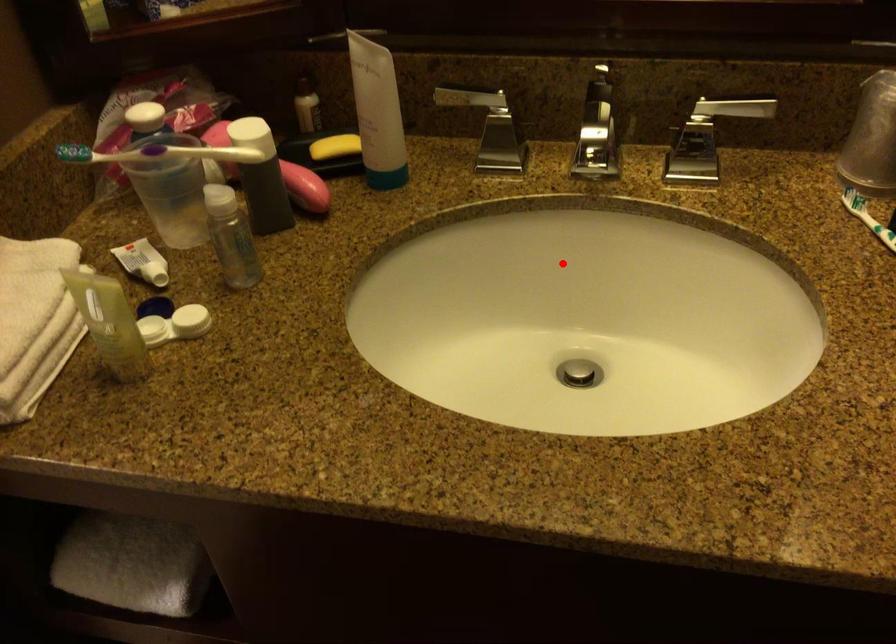
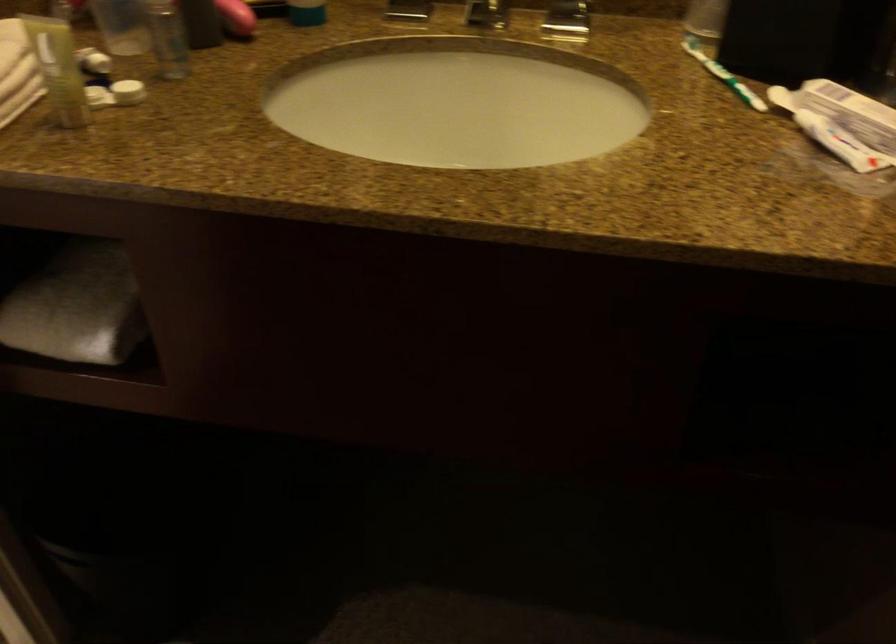
The point at the highlighted location is marked in the first image. Where is the corresponding point in the second image?

(457, 102)